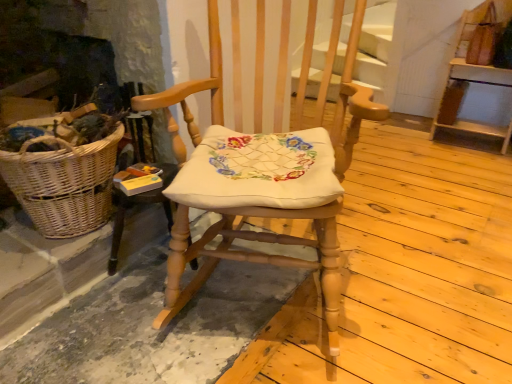
Question: From a real-world perspective, is wooden rocking chair at center located higher than wooden shelf at upper right?

Choices:
 (A) no
 (B) yes

Answer: (B)

Question: Could you tell me if wooden rocking chair at center is turned towards wooden shelf at upper right?

Choices:
 (A) no
 (B) yes

Answer: (A)

Question: Is wooden rocking chair at center taller than wooden shelf at upper right?

Choices:
 (A) yes
 (B) no

Answer: (A)

Question: From the image's perspective, is wooden rocking chair at center located above wooden shelf at upper right?

Choices:
 (A) no
 (B) yes

Answer: (A)

Question: From a real-world perspective, is wooden rocking chair at center beneath wooden shelf at upper right?

Choices:
 (A) yes
 (B) no

Answer: (B)

Question: Would you consider wooden rocking chair at center to be distant from wooden shelf at upper right?

Choices:
 (A) no
 (B) yes

Answer: (B)

Question: From a real-world perspective, does woven wicker picnic basket at left sit lower than wooden shelf at upper right?

Choices:
 (A) yes
 (B) no

Answer: (A)

Question: From a real-world perspective, is woven wicker picnic basket at left positioned over wooden shelf at upper right based on gravity?

Choices:
 (A) no
 (B) yes

Answer: (A)

Question: Is woven wicker picnic basket at left positioned far away from wooden shelf at upper right?

Choices:
 (A) yes
 (B) no

Answer: (A)

Question: Is woven wicker picnic basket at left aimed at wooden shelf at upper right?

Choices:
 (A) yes
 (B) no

Answer: (B)

Question: Does woven wicker picnic basket at left have a lesser height compared to wooden shelf at upper right?

Choices:
 (A) no
 (B) yes

Answer: (B)

Question: Does woven wicker picnic basket at left have a greater height compared to wooden shelf at upper right?

Choices:
 (A) yes
 (B) no

Answer: (B)

Question: From the image's perspective, does wooden shelf at upper right appear lower than wooden rocking chair at center?

Choices:
 (A) no
 (B) yes

Answer: (A)